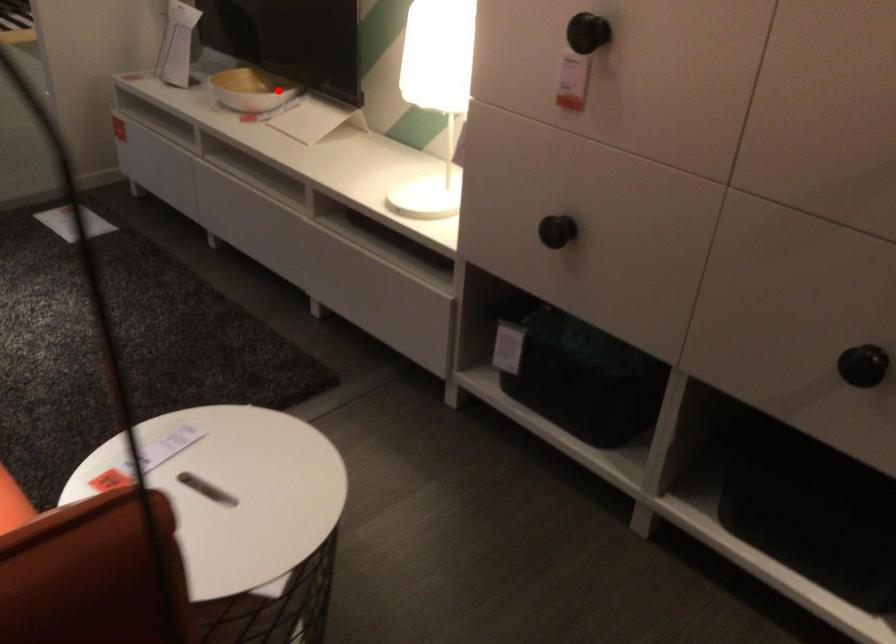
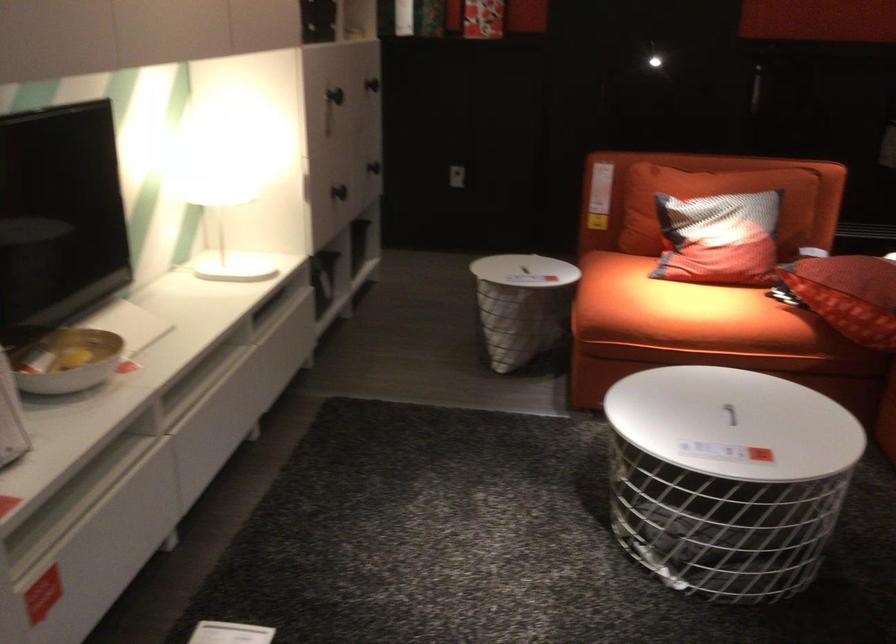
In the second image, find the point that corresponds to the highlighted location in the first image.

(66, 361)